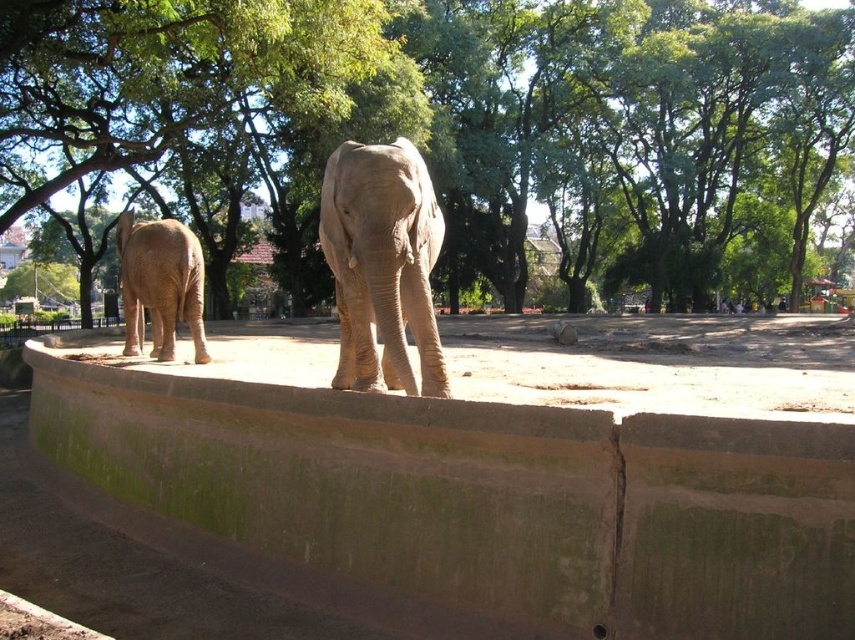
You are standing at the point marked as point (382, 264) in the image. What animal do you see directly in front of you?

The gray textured elephant at center is located at point (382, 264), so you would see the gray textured elephant at center directly in front of you.

You are a zookeeper standing at the entrance of the enclosure. You need to walk to the gray textured elephant at center to feed it. However, there is a green leafy tree at upper left blocking your path. Can you walk around the tree to reach the elephant?

The green leafy tree at upper left is to the left of the gray textured elephant at center, so you can walk around the tree on the right side to reach the elephant.